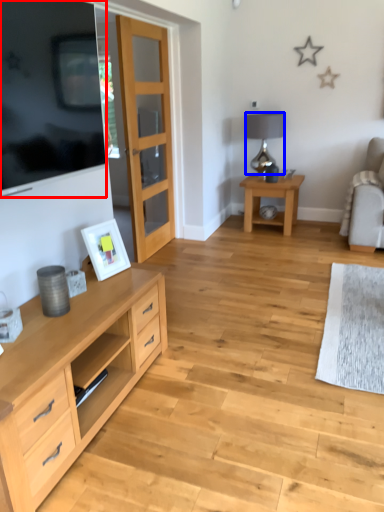
Question: Which point is closer to the camera, television (highlighted by a red box) or lamp (highlighted by a blue box)?

Choices:
 (A) television
 (B) lamp

Answer: (A)